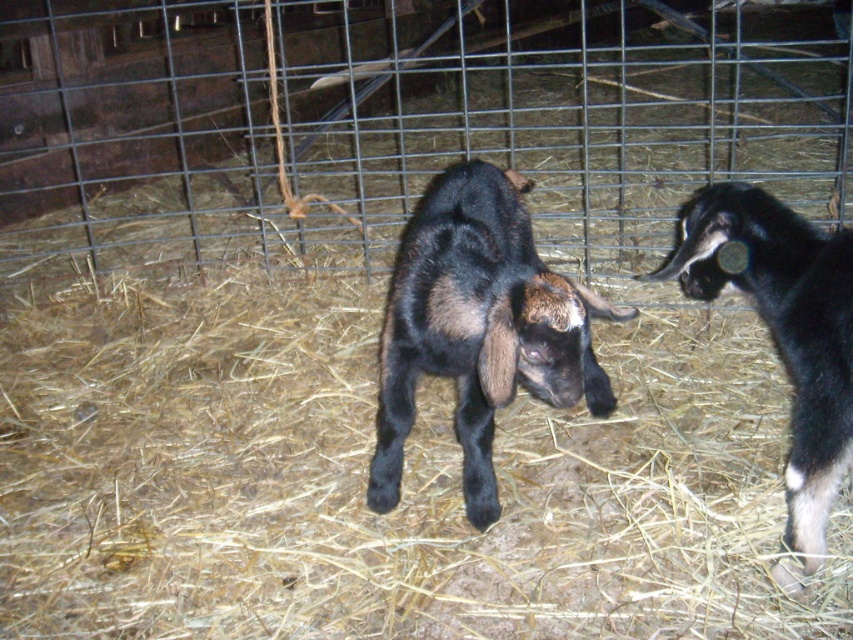
Can you confirm if black soft fur goat at center is wider than black matte goat at right?

Yes.

Can you confirm if black soft fur goat at center is positioned below black matte goat at right?

No.

Is point (514, 298) more distant than point (798, 369)?

No, it is in front of (798, 369).

Identify the location of black soft fur goat at center. (479, 326).

Can you confirm if brown straw at center is wider than black soft fur goat at center?

Correct, the width of brown straw at center exceeds that of black soft fur goat at center.

Is brown straw at center bigger than black soft fur goat at center?

Indeed, brown straw at center has a larger size compared to black soft fur goat at center.

Does point (474, 620) come farther from viewer compared to point (489, 330)?

Yes, point (474, 620) is farther from viewer.

The width and height of the screenshot is (853, 640). Find the location of `brown straw at center`. brown straw at center is located at coordinates (364, 480).

Is brown straw at center wider than black matte goat at right?

Correct, the width of brown straw at center exceeds that of black matte goat at right.

Can you confirm if brown straw at center is thinner than black matte goat at right?

In fact, brown straw at center might be wider than black matte goat at right.

Between point (364, 362) and point (788, 257), which one is positioned behind?

The point (364, 362) is behind.

This screenshot has height=640, width=853. I want to click on brown straw at center, so click(364, 480).